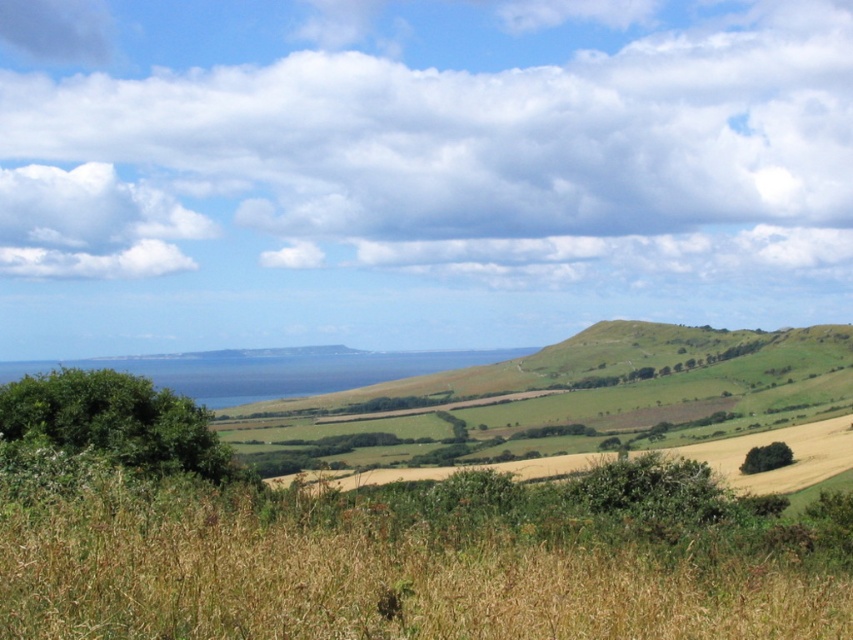
Question: Is white fluffy cloud at upper center smaller than white fluffy cloud at upper left?

Choices:
 (A) no
 (B) yes

Answer: (A)

Question: Which object appears closest to the camera in this image?

Choices:
 (A) white fluffy cloud at upper left
 (B) white fluffy cloud at upper center

Answer: (B)

Question: Can you confirm if white fluffy cloud at upper center is positioned to the left of white fluffy cloud at upper left?

Choices:
 (A) no
 (B) yes

Answer: (A)

Question: Does white fluffy cloud at upper center appear over white fluffy cloud at upper left?

Choices:
 (A) no
 (B) yes

Answer: (B)